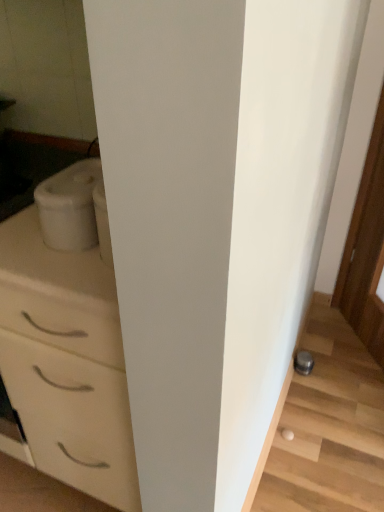
Question: Should I look upward or downward to see metallic gray stairwell at lower right?

Choices:
 (A) down
 (B) up

Answer: (A)

Question: Is white glossy chest of drawers at left completely or partially outside of white matte container at left?

Choices:
 (A) yes
 (B) no

Answer: (A)

Question: From a real-world perspective, is white glossy chest of drawers at left physically below white matte container at left?

Choices:
 (A) yes
 (B) no

Answer: (A)

Question: Is white glossy chest of drawers at left at the right side of white matte container at left?

Choices:
 (A) yes
 (B) no

Answer: (B)

Question: Is white glossy chest of drawers at left positioned in front of white matte container at left?

Choices:
 (A) yes
 (B) no

Answer: (A)

Question: Can you confirm if white glossy chest of drawers at left is positioned to the left of white matte container at left?

Choices:
 (A) yes
 (B) no

Answer: (A)

Question: Is white glossy chest of drawers at left facing away from white matte container at left?

Choices:
 (A) yes
 (B) no

Answer: (B)

Question: Is white matte container at left looking in the opposite direction of white glossy chest of drawers at left?

Choices:
 (A) no
 (B) yes

Answer: (A)

Question: Considering the relative sizes of white matte container at left and white glossy chest of drawers at left in the image provided, is white matte container at left shorter than white glossy chest of drawers at left?

Choices:
 (A) yes
 (B) no

Answer: (A)

Question: Considering the relative sizes of white matte container at left and white glossy chest of drawers at left in the image provided, is white matte container at left smaller than white glossy chest of drawers at left?

Choices:
 (A) yes
 (B) no

Answer: (A)

Question: Is white matte container at left aimed at white glossy chest of drawers at left?

Choices:
 (A) yes
 (B) no

Answer: (B)

Question: From a real-world perspective, is white matte container at left over white glossy chest of drawers at left?

Choices:
 (A) no
 (B) yes

Answer: (B)

Question: From the image's perspective, is white matte container at left on top of white glossy chest of drawers at left?

Choices:
 (A) yes
 (B) no

Answer: (A)

Question: Is metallic gray stairwell at lower right outside of white matte container at left?

Choices:
 (A) no
 (B) yes

Answer: (B)